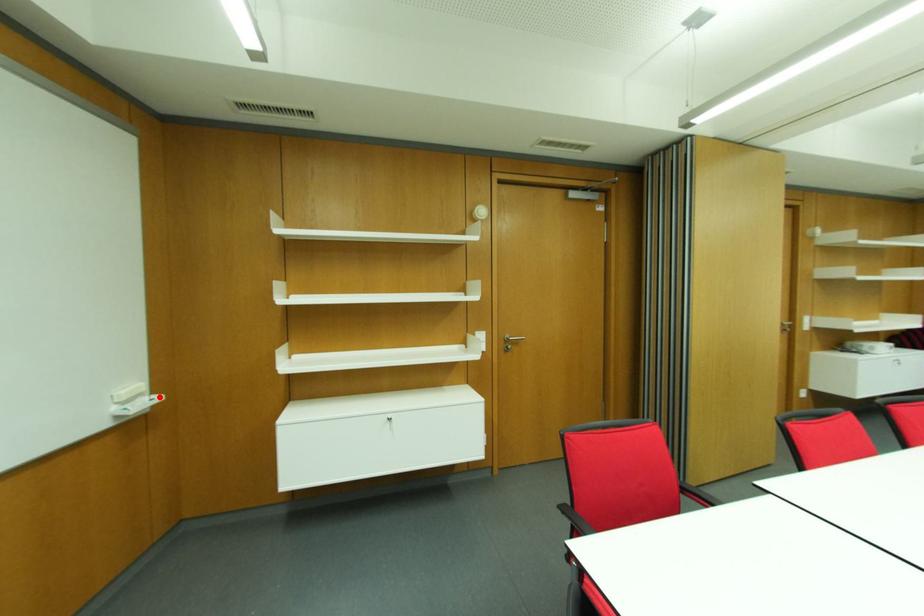
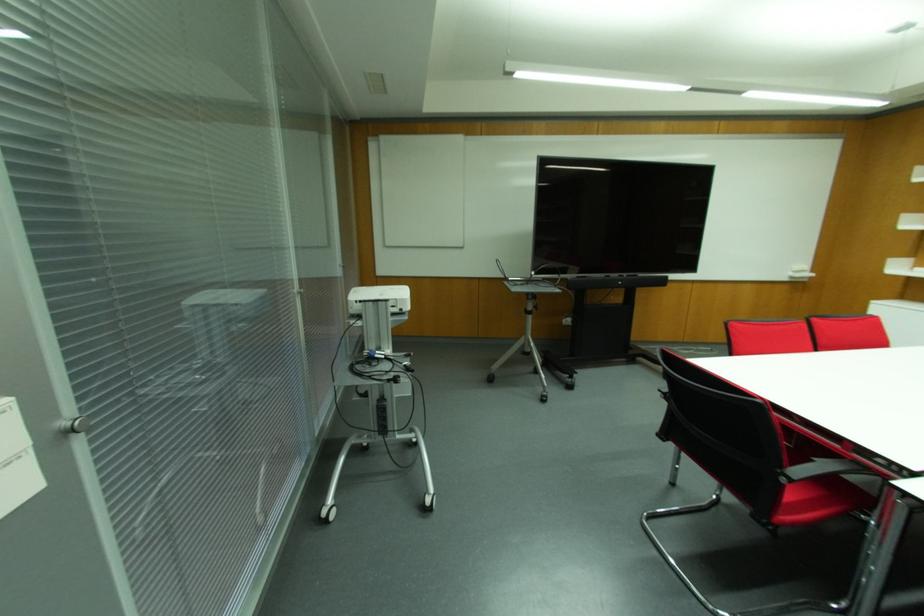
Locate, in the second image, the point that corresponds to the highlighted location in the first image.

(811, 274)